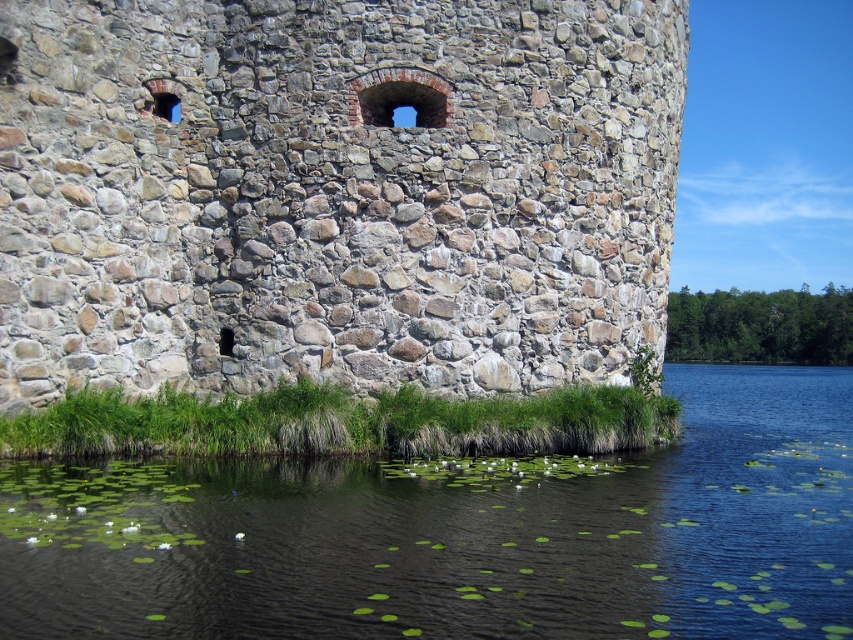
You are an architect designing a garden layout. The scene shows a natural stone wall at center and a green leafy pond at lower left. Which object takes up more area in the image?

The green leafy pond at lower left occupies more space than the natural stone wall at center according to the description.